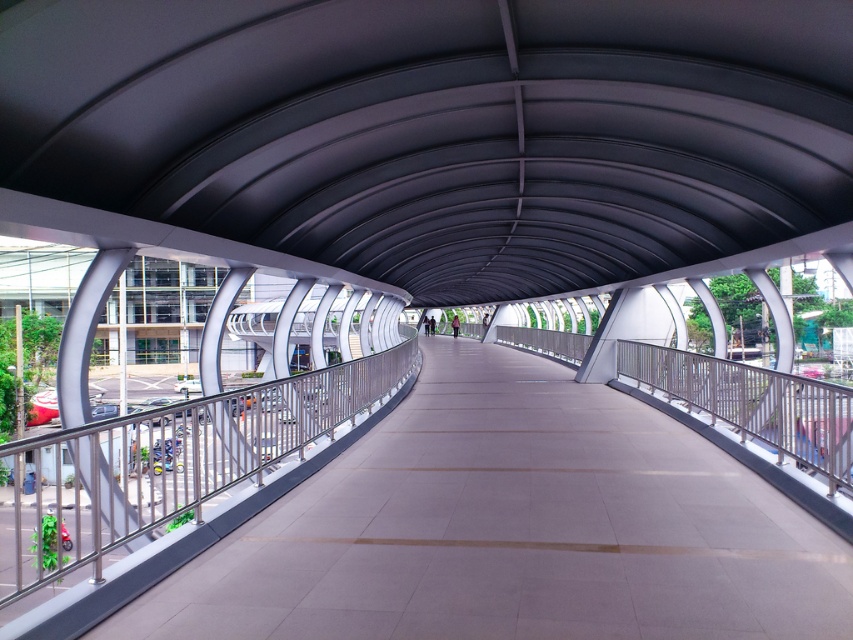
Which is more to the right, satin concrete walkway at center or satin silver railing at left?

satin concrete walkway at center is more to the right.

Is satin concrete walkway at center to the right of satin silver railing at left from the viewer's perspective?

Correct, you'll find satin concrete walkway at center to the right of satin silver railing at left.

Locate an element on the screen. The height and width of the screenshot is (640, 853). satin concrete walkway at center is located at coordinates (514, 529).

From the picture: Does satin concrete walkway at center come behind satin silver railing at center?

No, satin concrete walkway at center is closer to the viewer.

Identify the location of satin concrete walkway at center. (514, 529).

Between satin silver railing at left and satin silver railing at center, which one has more height?

satin silver railing at left

Is point (148, 416) closer to camera compared to point (642, 348)?

Yes, point (148, 416) is in front of point (642, 348).

Which is in front, point (167, 509) or point (635, 372)?

Point (167, 509) is more forward.

Find the location of `satin silver railing at left`. satin silver railing at left is located at coordinates (167, 461).